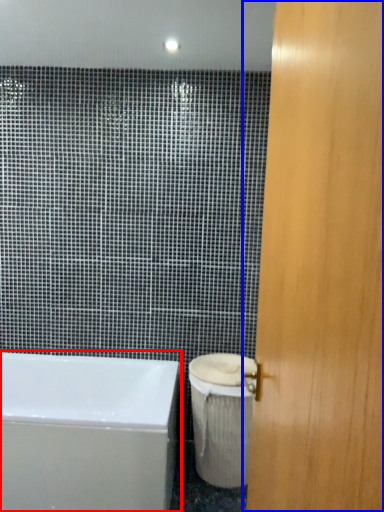
Question: Which of the following is the farthest to the observer, bathtub (highlighted by a red box) or door (highlighted by a blue box)?

Choices:
 (A) bathtub
 (B) door

Answer: (A)